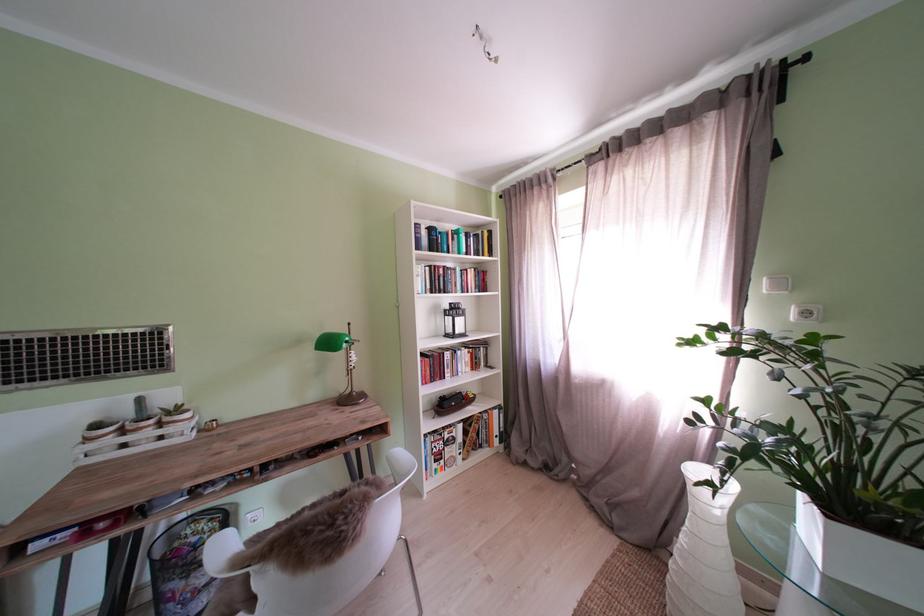
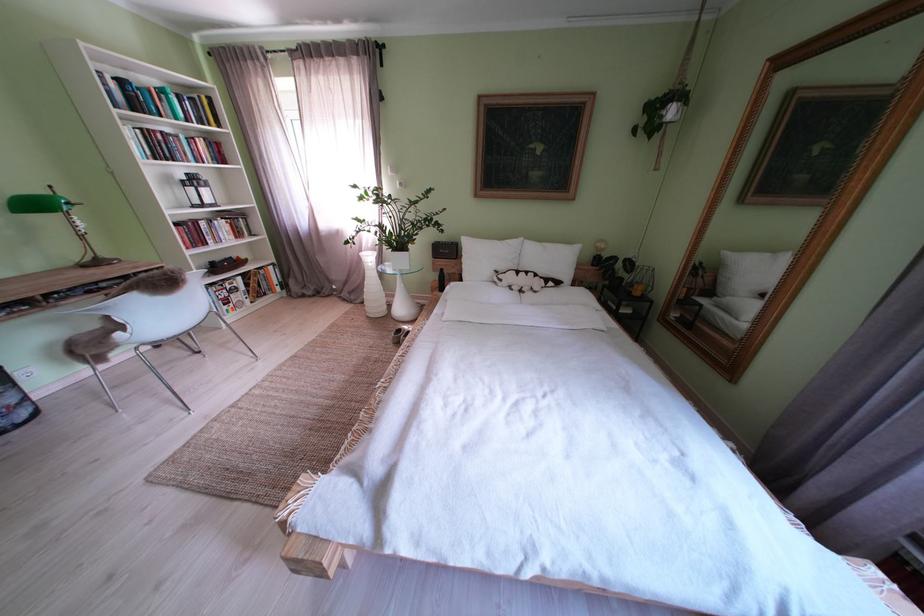
In the second image, find the point that corresponds to (843,517) in the first image.

(405, 256)